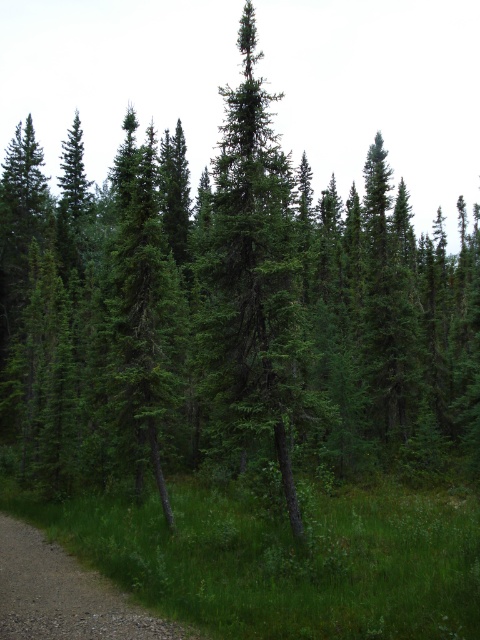
You are a hiker navigating through a dense forest. You see a point marked at coordinates [252,273]. What is located at this point?

The point at coordinates [252,273] marks a green needle like at center.